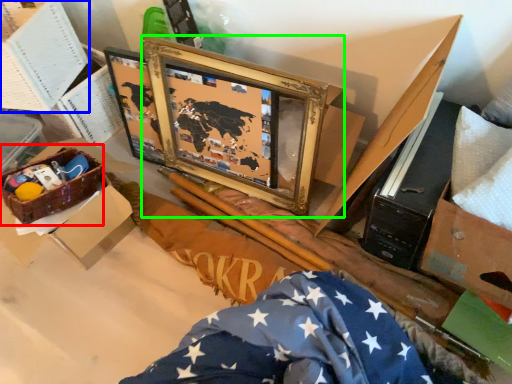
Question: Based on their relative distances, which object is farther from crate (highlighted by a red box)? Choose from box (highlighted by a blue box) and picture frame (highlighted by a green box).

Choices:
 (A) box
 (B) picture frame

Answer: (B)